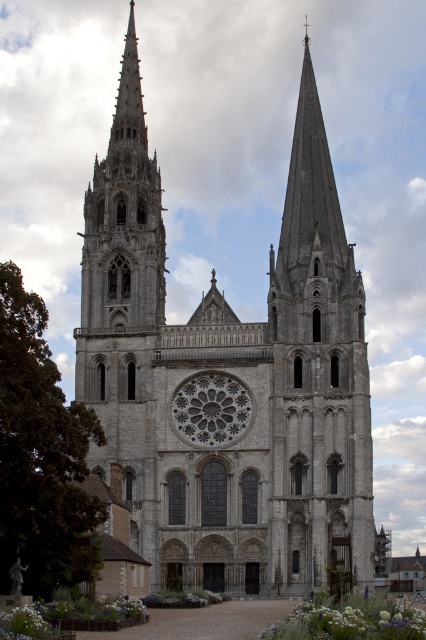
I want to click on gray stone church at center, so click(232, 374).

The height and width of the screenshot is (640, 426). What do you see at coordinates (232, 374) in the screenshot?
I see `gray stone church at center` at bounding box center [232, 374].

Identify the location of gray stone church at center. The height and width of the screenshot is (640, 426). (232, 374).